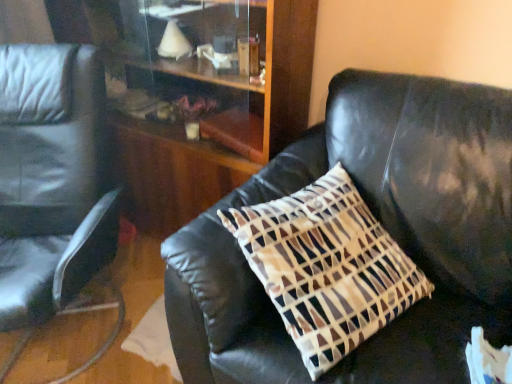
Question: Is velvet brown pillow at center situated inside wooden dresser at center or outside?

Choices:
 (A) inside
 (B) outside

Answer: (B)

Question: In terms of size, does velvet brown pillow at center appear bigger or smaller than wooden dresser at center?

Choices:
 (A) small
 (B) big

Answer: (A)

Question: Which object is positioned farthest from the matte black chair at left?

Choices:
 (A) velvet brown pillow at center
 (B) wooden dresser at center

Answer: (A)

Question: Which object is positioned farthest from the wooden dresser at center?

Choices:
 (A) velvet brown pillow at center
 (B) matte black chair at left

Answer: (B)